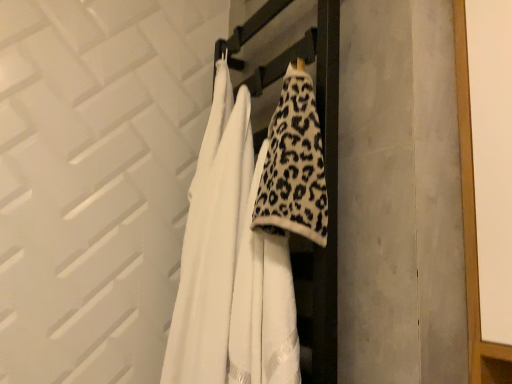
What is the approximate width of leopard print fabric at center?

The width of leopard print fabric at center is 4.23 inches.

The image size is (512, 384). I want to click on leopard print fabric at center, so click(294, 166).

Describe the element at coordinates (294, 166) in the screenshot. I see `leopard print fabric at center` at that location.

The width and height of the screenshot is (512, 384). I want to click on leopard print fabric at center, so click(x=294, y=166).